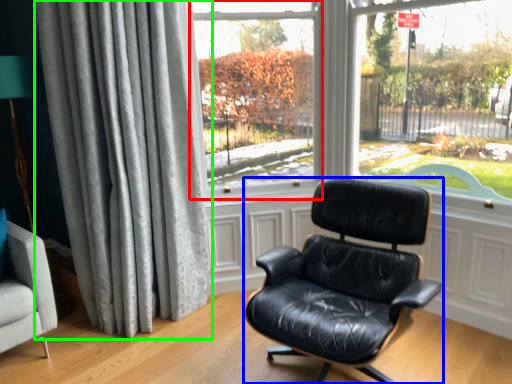
Question: Based on their relative distances, which object is farther from window screen (highlighted by a red box)? Choose from chair (highlighted by a blue box) and curtain (highlighted by a green box).

Choices:
 (A) chair
 (B) curtain

Answer: (A)